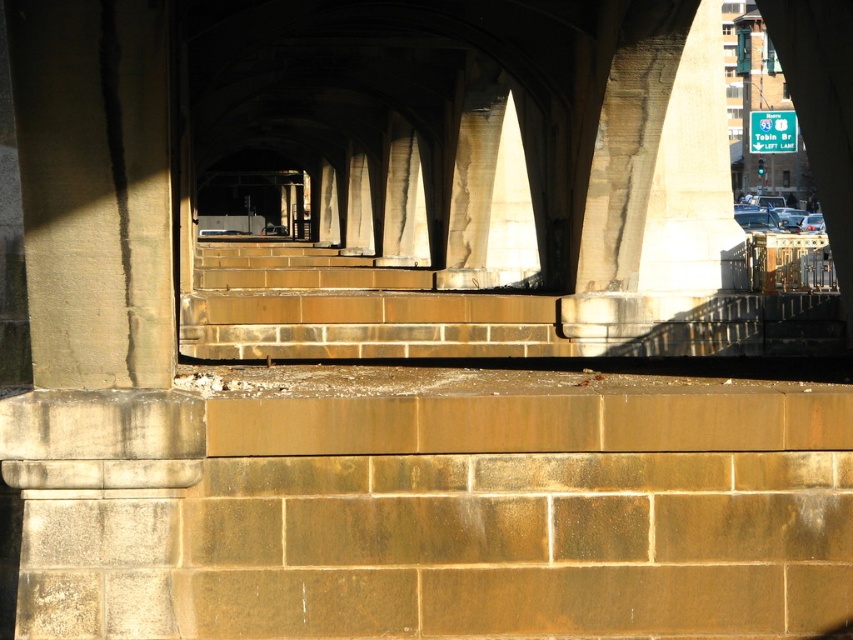
Question: Among these objects, which one is nearest to the camera?

Choices:
 (A) green plastic sign at upper right
 (B) brown stone stairs at center

Answer: (B)

Question: Considering the relative positions of brown stone stairs at center and green plastic sign at upper right in the image provided, where is brown stone stairs at center located with respect to green plastic sign at upper right?

Choices:
 (A) above
 (B) below

Answer: (B)

Question: Can you confirm if brown stone stairs at center is bigger than green plastic sign at upper right?

Choices:
 (A) yes
 (B) no

Answer: (A)

Question: Which object is farther from the camera taking this photo?

Choices:
 (A) brown stone stairs at center
 (B) green plastic sign at upper right

Answer: (B)

Question: Among these objects, which one is farthest from the camera?

Choices:
 (A) brown stone stairs at center
 (B) green plastic sign at upper right

Answer: (B)

Question: Does brown stone stairs at center have a greater width compared to green plastic sign at upper right?

Choices:
 (A) no
 (B) yes

Answer: (B)